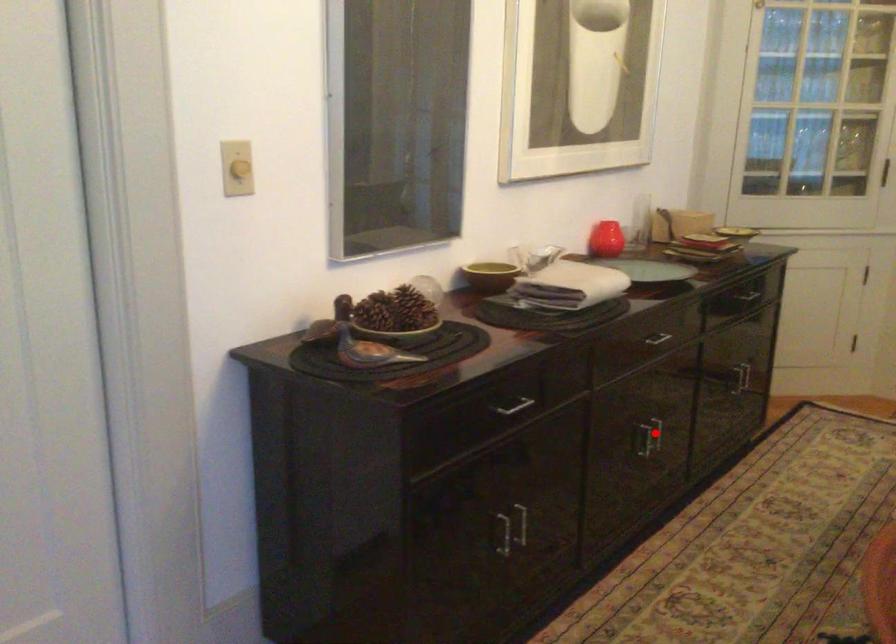
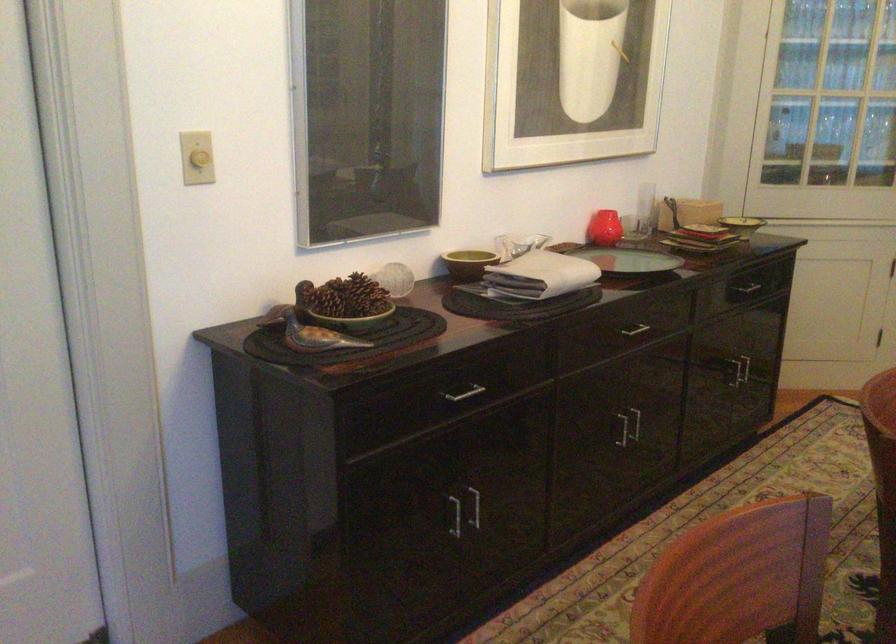
Question: I am providing you with two images of the same scene from different viewpoints. A red point is marked on the first image. Can you still see the location of the red point in image 2?

Choices:
 (A) Yes
 (B) No

Answer: (A)